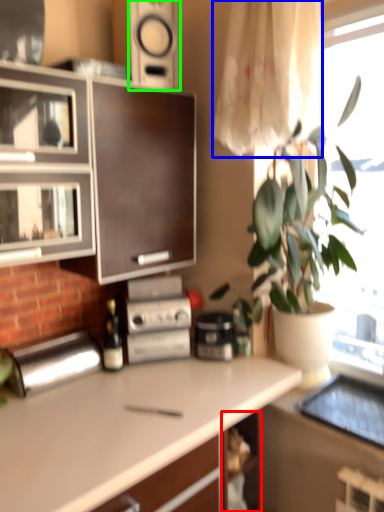
Question: Which is farther away from shelf (highlighted by a red box)? curtain (highlighted by a blue box) or speaker (highlighted by a green box)?

Choices:
 (A) curtain
 (B) speaker

Answer: (B)